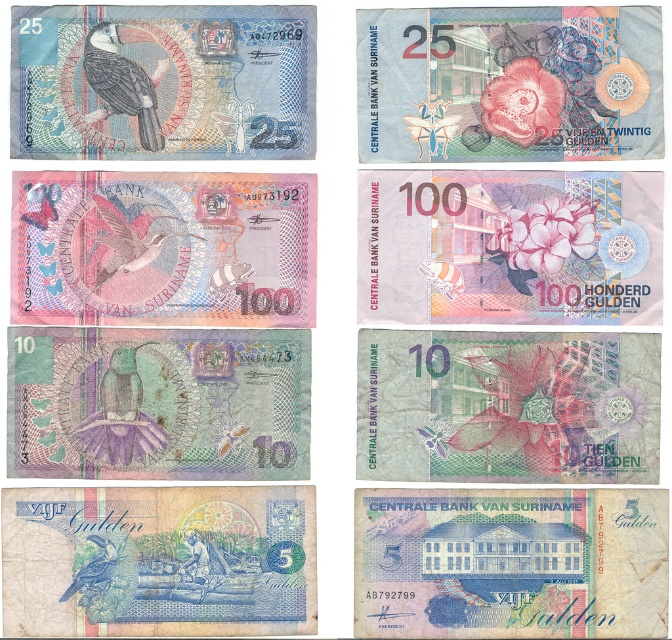
Question: Can you confirm if pink paper money at center is wider than matte black toucan at upper left?

Choices:
 (A) no
 (B) yes

Answer: (B)

Question: Where is matte black toucan at upper left located in relation to blue textured bird at lower left in the image?

Choices:
 (A) above
 (B) below

Answer: (A)

Question: Based on their relative distances, which object is farther from the matte black toucan at upper left?

Choices:
 (A) pink paper money at center
 (B) shiny pink hummingbird at center
 (C) blue paper currency at bottom right

Answer: (C)

Question: Which of the following is the farthest from the observer?

Choices:
 (A) (478, 280)
 (B) (413, 497)

Answer: (A)

Question: Does blue paper currency at bottom right have a greater width compared to blue textured bird at lower left?

Choices:
 (A) yes
 (B) no

Answer: (A)

Question: Estimate the real-world distances between objects in this image. Which object is farther from the pink paper money at center?

Choices:
 (A) shiny pink hummingbird at center
 (B) blue textured bird at lower left

Answer: (B)